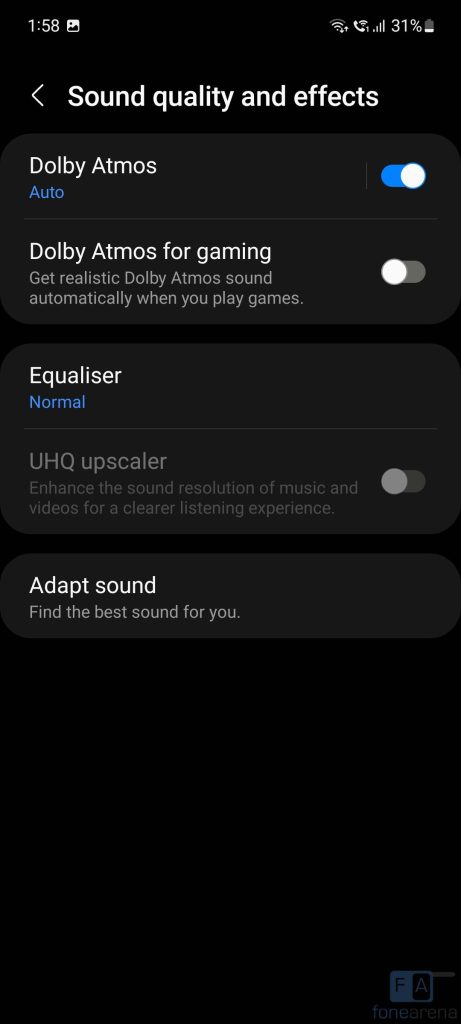
This screenshot has width=461, height=1024. Identify the location of wifi quality bar. 335,23.